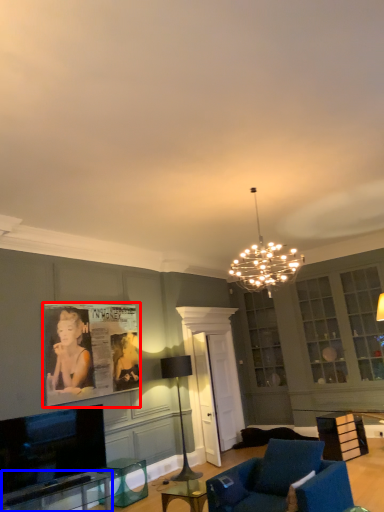
Question: Among these objects, which one is nearest to the camera, picture frame (highlighted by a red box) or table (highlighted by a blue box)?

Choices:
 (A) picture frame
 (B) table

Answer: (B)